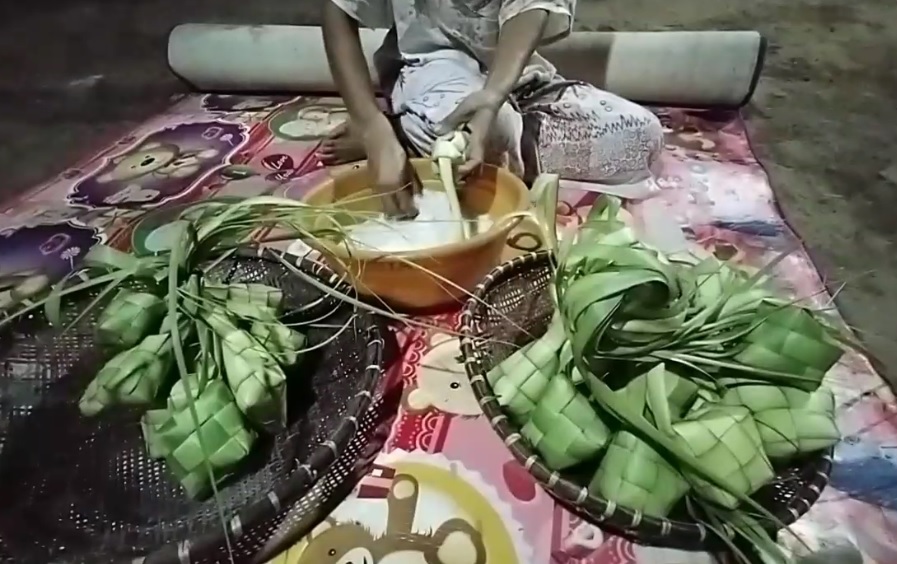
Identify the location of dirty flooring. (800, 58).